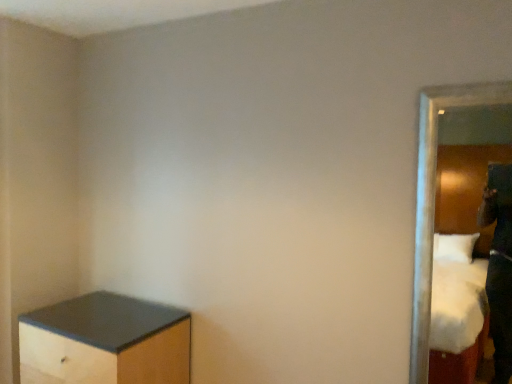
I want to click on wooden desk at lower left, so click(x=105, y=342).

Image resolution: width=512 pixels, height=384 pixels. What do you see at coordinates (105, 342) in the screenshot?
I see `wooden desk at lower left` at bounding box center [105, 342].

Where is `wooden desk at lower left`? wooden desk at lower left is located at coordinates (105, 342).